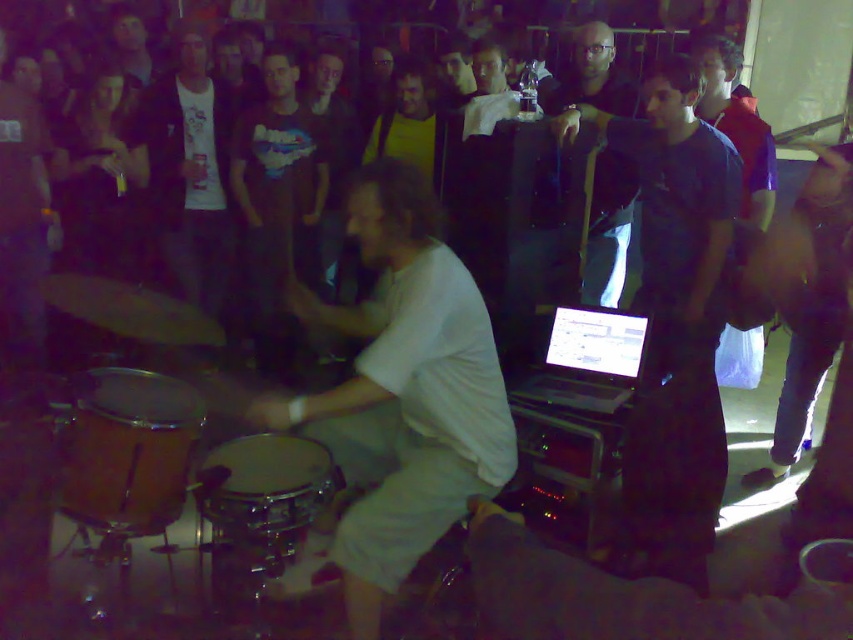
Question: Can you confirm if dark blue t-shirt at center is positioned below shiny chrome snare at center?

Choices:
 (A) no
 (B) yes

Answer: (A)

Question: Can you confirm if white t-shirt at center is positioned to the left of black matte jacket at upper center?

Choices:
 (A) no
 (B) yes

Answer: (B)

Question: Which point is farther to the camera?

Choices:
 (A) dark gray t-shirt at center
 (B) white t-shirt at center
 (C) wooden drum at center

Answer: (B)

Question: Which of the following is the closest to the observer?

Choices:
 (A) (688, 259)
 (B) (131, 387)
 (C) (155, 96)
 (D) (328, 474)

Answer: (D)

Question: Does white matte shirt at center have a smaller size compared to shiny chrome snare at center?

Choices:
 (A) yes
 (B) no

Answer: (B)

Question: Which object is positioned farthest from the shiny chrome snare at center?

Choices:
 (A) black matte jacket at upper center
 (B) white t-shirt at center
 (C) white matte shirt at center
 (D) wooden drum at center

Answer: (B)